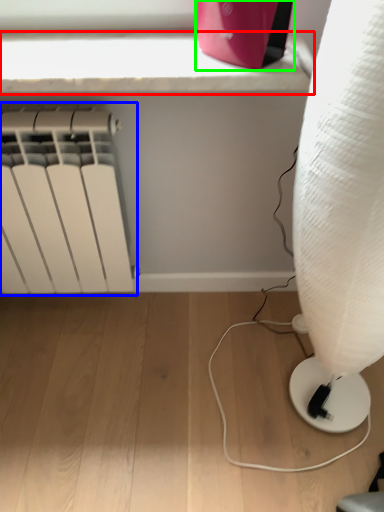
Question: Estimate the real-world distances between objects in this image. Which object is closer to window sill (highlighted by a red box), radiator (highlighted by a blue box) or appliance (highlighted by a green box)?

Choices:
 (A) radiator
 (B) appliance

Answer: (B)